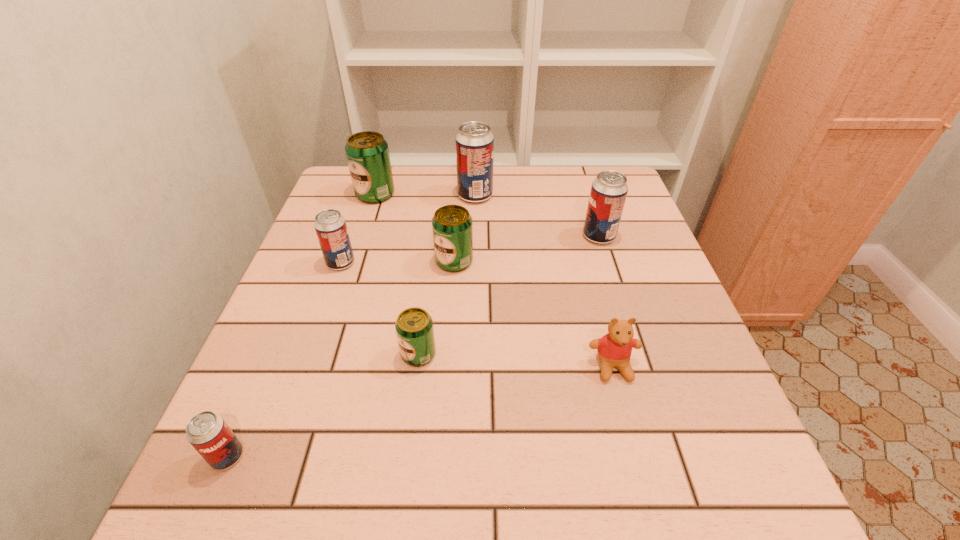
The image size is (960, 540). In order to click on free space at the right edge of the desktop in this screenshot , I will do point(721,447).

The image size is (960, 540). In order to click on free area in between the biggest red beer can and the third nearest red beer can in this screenshot , I will do `click(537, 216)`.

Where is `vacant space that is in between the second farthest green beer can and the second nearest beer can`? Image resolution: width=960 pixels, height=540 pixels. vacant space that is in between the second farthest green beer can and the second nearest beer can is located at coordinates (437, 308).

At what (x,y) coordinates should I click in order to perform the action: click on vacant area that lies between the second nearest green beer can and the leftmost red beer can. Please return your answer as a coordinate pair (x, y). Looking at the image, I should click on (341, 359).

Identify the location of vacant region between the sixth farthest beer can and the nearest beer can. (324, 406).

Where is `empty location between the smallest green beer can and the red teddy bear`? The image size is (960, 540). empty location between the smallest green beer can and the red teddy bear is located at coordinates (516, 361).

This screenshot has width=960, height=540. Identify the location of unoccupied area between the tallest beer can and the nearest red beer can. (351, 326).

Locate an element on the screen. This screenshot has height=540, width=960. blank region between the sixth nearest object and the biggest red beer can is located at coordinates 537,216.

At what (x,y) coordinates should I click in order to perform the action: click on vacant point located between the red teddy bear and the biggest green beer can. Please return your answer as a coordinate pair (x, y). The width and height of the screenshot is (960, 540). Looking at the image, I should click on (494, 281).

Where is `blank region between the nearest red beer can and the red teddy bear`? blank region between the nearest red beer can and the red teddy bear is located at coordinates (420, 411).